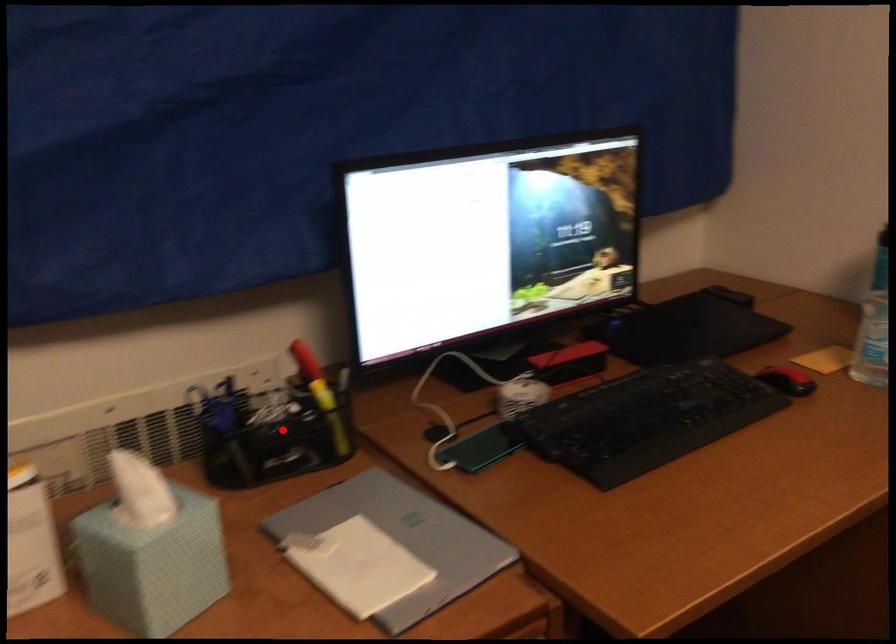
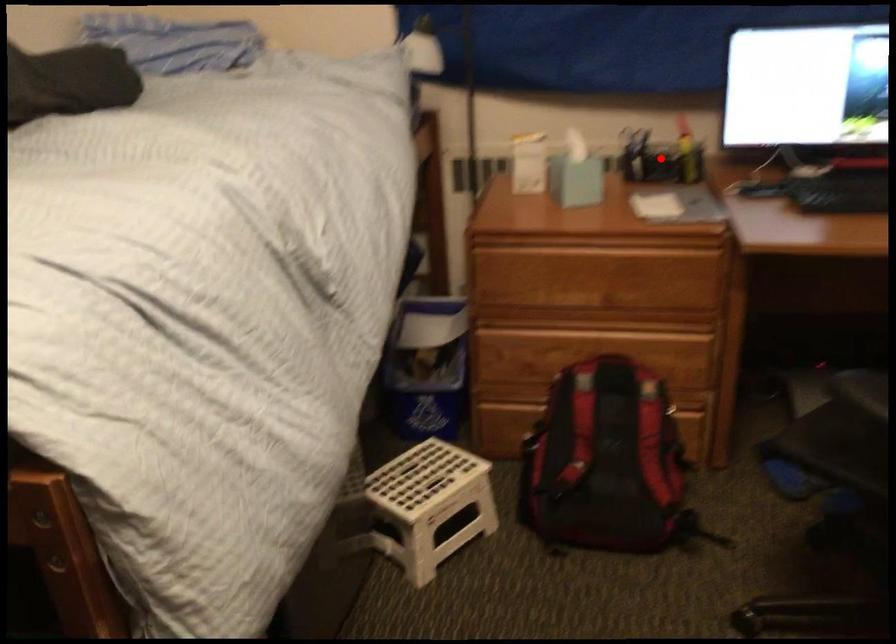
I am providing you with two images of the same scene from different viewpoints. A red point is marked on the first image and another point is marked on the second image. Do the highlighted points in image1 and image2 indicate the same real-world spot?

Yes